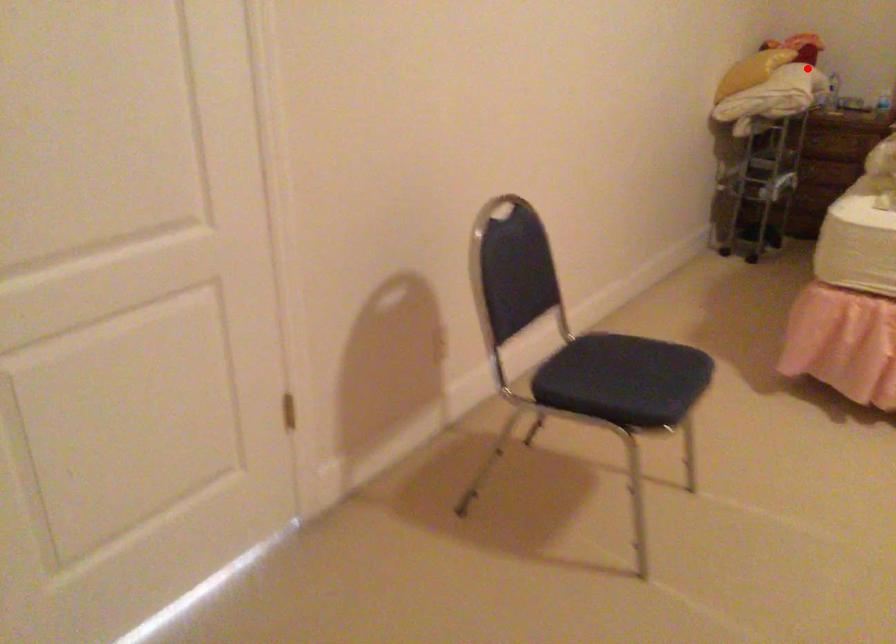
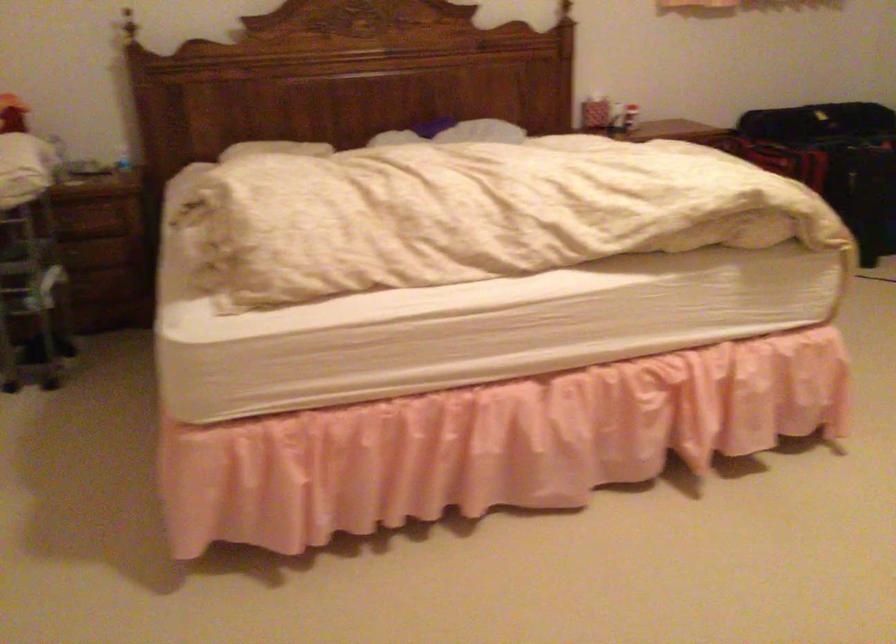
Question: I am providing you with two images of the same scene from different viewpoints. Image1 has a red point marked. In image2, the corresponding 3D location appears at what relative position? Reply with the corresponding letter.

Choices:
 (A) Closer
 (B) Farther

Answer: (A)